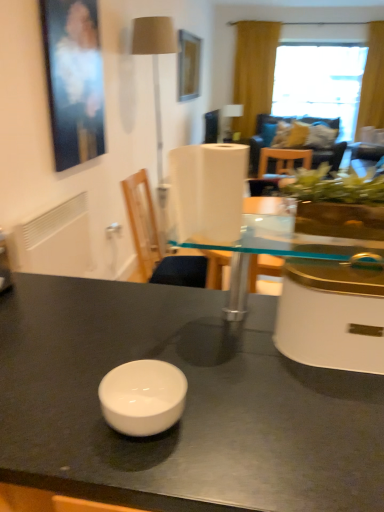
Find the location of a particular element. Image resolution: width=384 pixels, height=512 pixels. free point to the left of white glossy bowl at center is located at coordinates (57, 412).